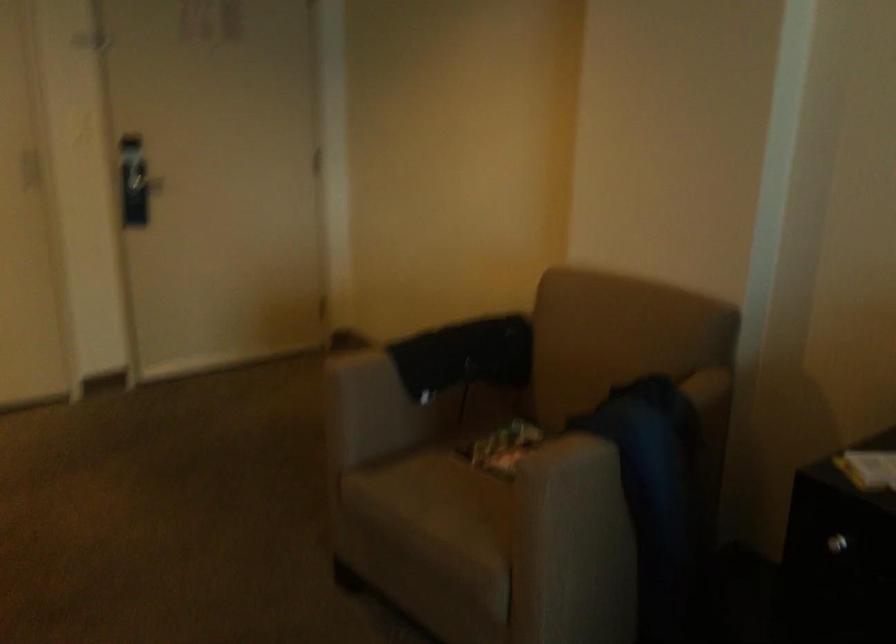
Image resolution: width=896 pixels, height=644 pixels. Describe the element at coordinates (135, 182) in the screenshot. I see `the door handle` at that location.